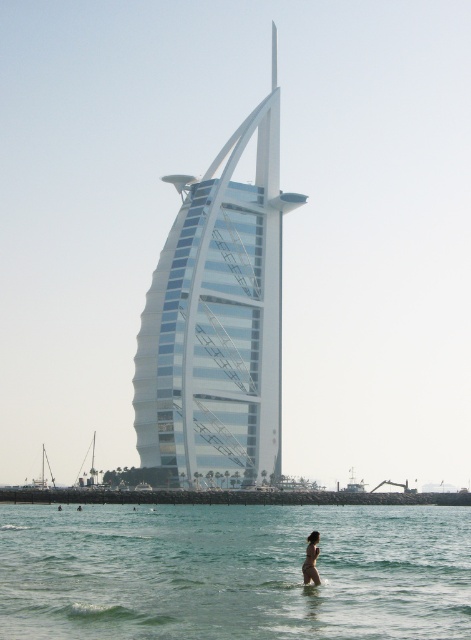
Question: Which is nearer to the clear water at lower center?

Choices:
 (A) white glass tower at center
 (B) tan skin human at lower center

Answer: (B)

Question: Can you confirm if clear water at lower center is positioned to the left of tan skin human at lower center?

Choices:
 (A) yes
 (B) no

Answer: (A)

Question: Which object appears closest to the camera in this image?

Choices:
 (A) white glass tower at center
 (B) tan skin human at lower center

Answer: (B)

Question: Can you confirm if clear water at lower center is positioned below tan skin human at lower center?

Choices:
 (A) no
 (B) yes

Answer: (B)

Question: Can you confirm if white glass tower at center is thinner than tan skin human at lower center?

Choices:
 (A) yes
 (B) no

Answer: (B)

Question: Based on their relative distances, which object is farther from the white glass tower at center?

Choices:
 (A) tan skin human at lower center
 (B) clear water at lower center

Answer: (A)